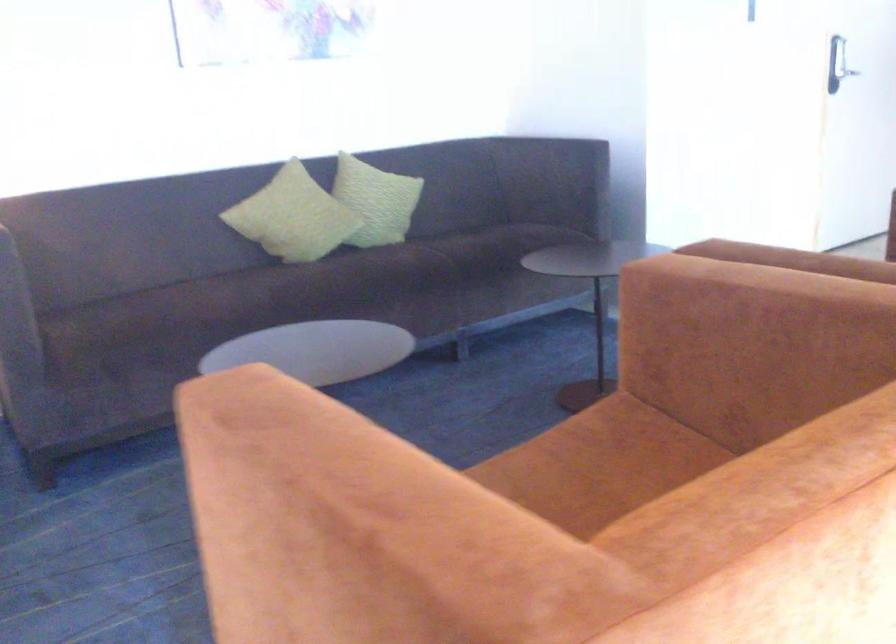
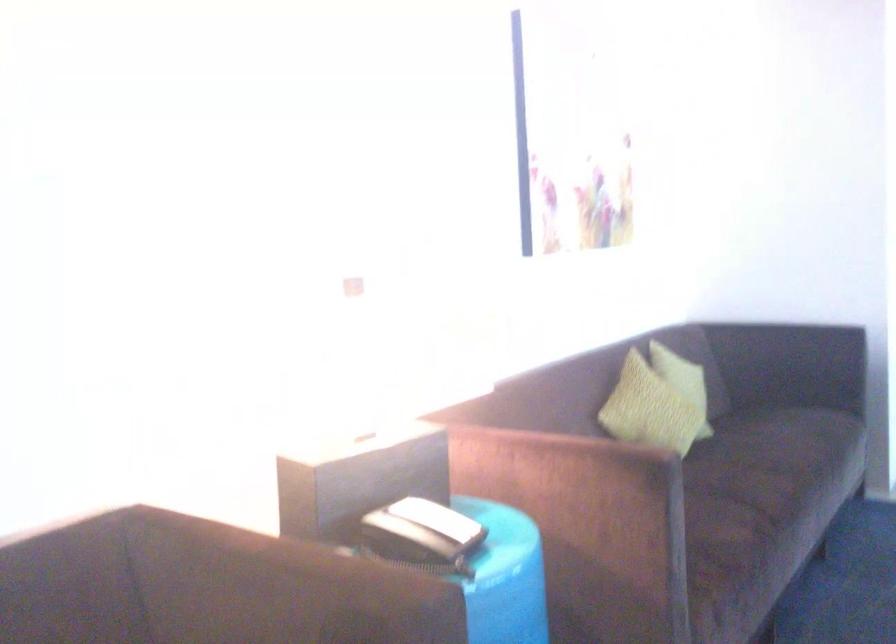
Question: I am providing you with two images of the same scene from different viewpoints. Please identify which objects are invisible in image2.

Choices:
 (A) dark sofa sitting surface
 (B) yellowish pillow
 (C) light green pillow
 (D) Nature magazine

Answer: (C)